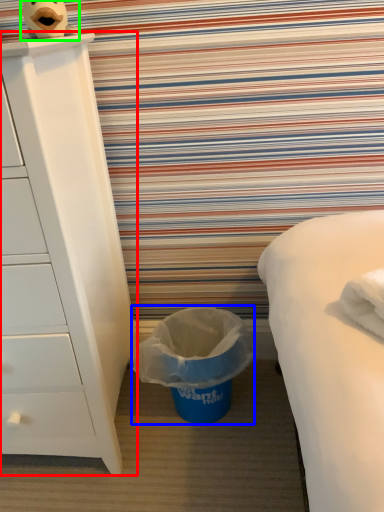
Question: Based on their relative distances, which object is farther from chest of drawers (highlighted by a red box)? Choose from garbage (highlighted by a blue box) and toy (highlighted by a green box).

Choices:
 (A) garbage
 (B) toy

Answer: (B)